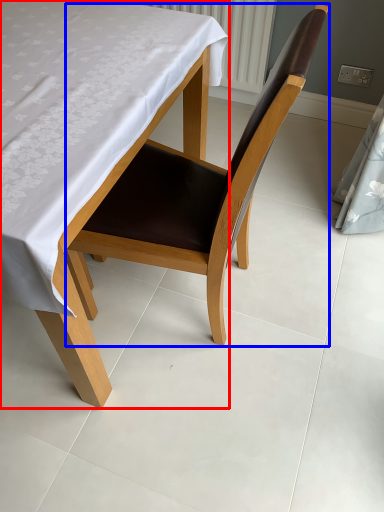
Question: Which of the following is the closest to the observer, table (highlighted by a red box) or chair (highlighted by a blue box)?

Choices:
 (A) table
 (B) chair

Answer: (A)